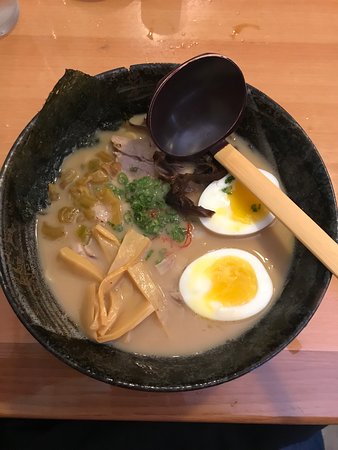
You are a GUI agent. You are given a task and a screenshot of the screen. Output one action in this format:
    pyautogui.click(x=<x>, y=<y>)
    Task: Click on the bowl
    
    Given the screenshot: What is the action you would take?
    pyautogui.click(x=175, y=387), pyautogui.click(x=37, y=187), pyautogui.click(x=281, y=149)